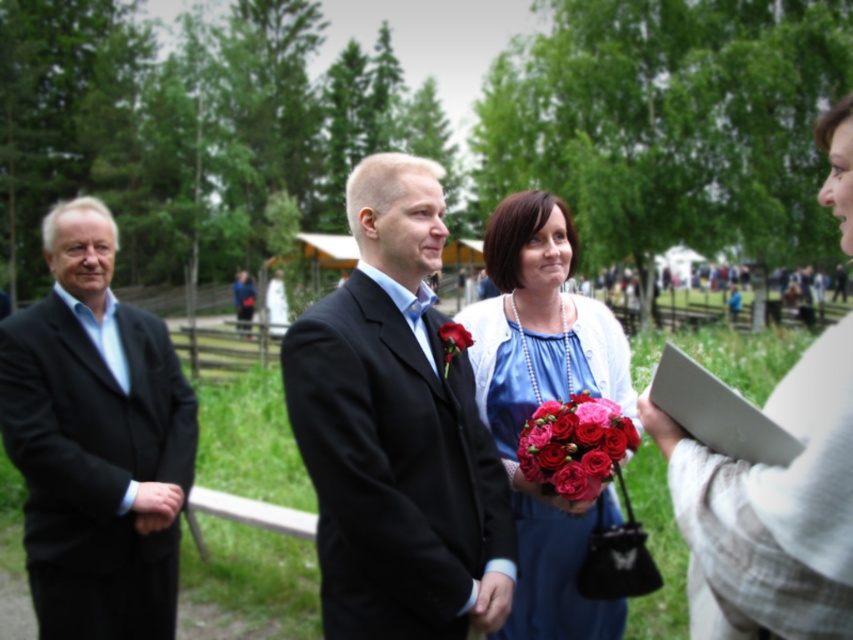
You are standing at the point labeled as point [415,593]. You want to throw a ball to someone standing 2 meters away. Can you reach them?

The distance between you and the viewer is 2.20 meters, so yes, you can throw the ball to someone 2 meters away as the distance is sufficient.

You are attending a formal event and need to find the tallest person wearing a black suit. Based on the image, which individual is taller between the matte black suit at center and the black matte suit at left?

The matte black suit at center is much taller than the black matte suit at left, so the tallest person is the matte black suit at center.

You are a photographer at the event and want to take a photo of the black matte suit at left. What coordinates should you focus on?

The black matte suit at left is located at coordinates point (96, 440).